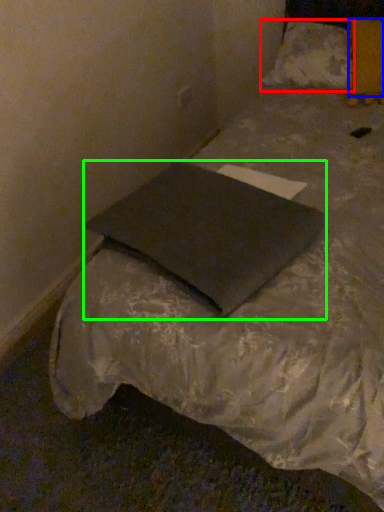
Question: Considering the real-world distances, which object is closest to pillow (highlighted by a red box)? pillow (highlighted by a blue box) or pillow (highlighted by a green box).

Choices:
 (A) pillow
 (B) pillow

Answer: (A)